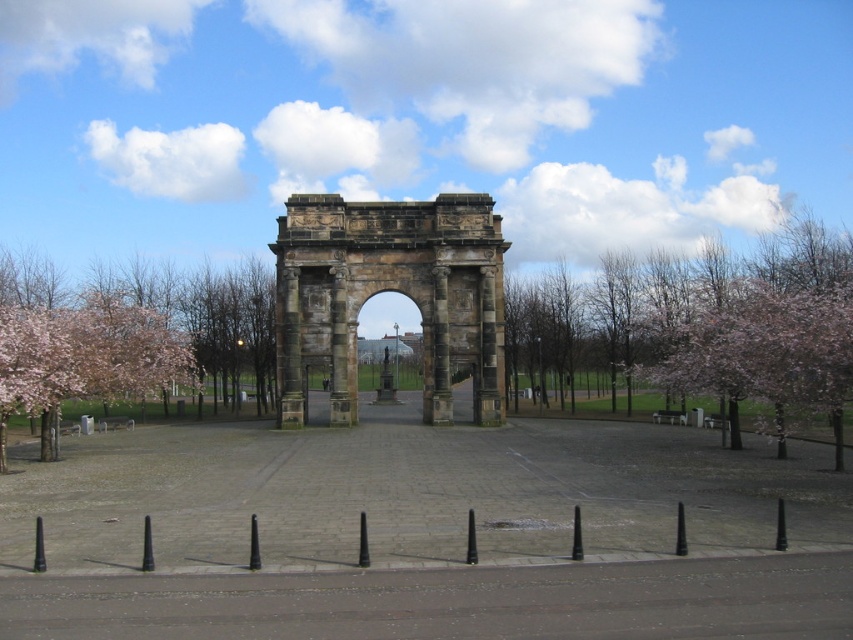
Who is lower down, stone archway at center or pink blossoms at left?

Positioned lower is pink blossoms at left.

Is point (315, 234) behind point (13, 360)?

Yes, point (315, 234) is farther from viewer.

The height and width of the screenshot is (640, 853). I want to click on stone archway at center, so click(389, 291).

Based on the photo, which is below, pink blossoms at right or stone archway at center?

pink blossoms at right is lower down.

Which is in front, point (670, 384) or point (412, 269)?

Point (670, 384)

Image resolution: width=853 pixels, height=640 pixels. Describe the element at coordinates (735, 324) in the screenshot. I see `pink blossoms at right` at that location.

What are the coordinates of `pink blossoms at right` in the screenshot? It's located at (735, 324).

Is pink blossoms at right positioned behind pink blossoms at left?

No, pink blossoms at right is in front of pink blossoms at left.

Consider the image. Can you confirm if pink blossoms at right is wider than pink blossoms at left?

Indeed, pink blossoms at right has a greater width compared to pink blossoms at left.

The height and width of the screenshot is (640, 853). I want to click on pink blossoms at right, so click(x=735, y=324).